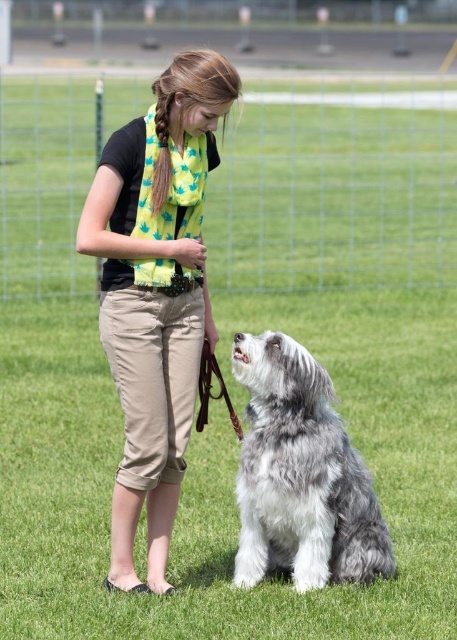
Who is shorter, green scarf at center or fluffy gray fur at center?

With less height is fluffy gray fur at center.

Can you confirm if green scarf at center is bigger than fluffy gray fur at center?

Yes.

The height and width of the screenshot is (640, 457). What do you see at coordinates (155, 300) in the screenshot? I see `green scarf at center` at bounding box center [155, 300].

Locate an element on the screen. The image size is (457, 640). green scarf at center is located at coordinates (155, 300).

Is point (128, 573) behind point (154, 189)?

Yes, it is.

Which is behind, point (141, 433) or point (168, 109)?

Positioned behind is point (141, 433).

This screenshot has width=457, height=640. I want to click on green scarf at center, so click(155, 300).

Is fluffy gray fur at center shorter than golden hair braid at upper center?

No, fluffy gray fur at center is not shorter than golden hair braid at upper center.

Does fluffy gray fur at center appear under golden hair braid at upper center?

Yes.

Does point (372, 564) come farther from viewer compared to point (154, 124)?

Yes, point (372, 564) is behind point (154, 124).

At what (x,y) coordinates should I click in order to perform the action: click on fluffy gray fur at center. Please return your answer as a coordinate pair (x, y). The width and height of the screenshot is (457, 640). Looking at the image, I should click on (301, 476).